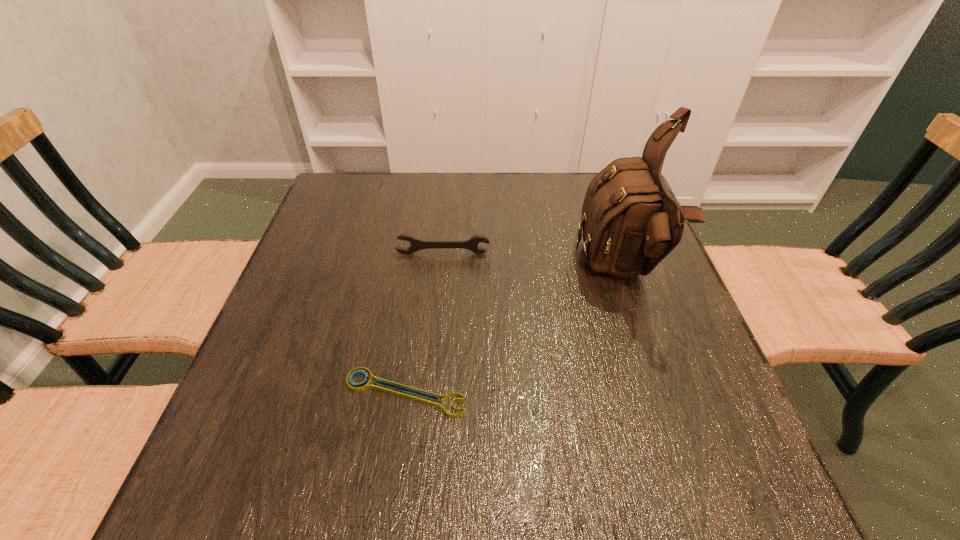
This screenshot has height=540, width=960. In order to click on vacant point located 0.060m on the left of the nearer wrench in this screenshot , I will do `click(311, 393)`.

In order to click on object at the right edge in this screenshot , I will do `click(630, 223)`.

I want to click on free region at the far edge of the desktop, so click(563, 190).

Where is `free space at the near edge of the desktop`? This screenshot has width=960, height=540. free space at the near edge of the desktop is located at coordinates (392, 490).

Where is `vacant space at the left edge of the desktop`? Image resolution: width=960 pixels, height=540 pixels. vacant space at the left edge of the desktop is located at coordinates (276, 337).

The image size is (960, 540). What are the coordinates of `vacant space at the right edge of the desktop` in the screenshot? It's located at (667, 407).

Image resolution: width=960 pixels, height=540 pixels. Find the location of `free space at the far left corner of the desktop`. free space at the far left corner of the desktop is located at coordinates (355, 184).

The image size is (960, 540). In order to click on vacant space at the near left corner of the desktop in this screenshot , I will do `click(246, 459)`.

Locate an element on the screen. This screenshot has width=960, height=540. free space at the far right corner of the desktop is located at coordinates tap(576, 184).

This screenshot has width=960, height=540. Identify the location of free spot between the tallest object and the nearest object. [513, 333].